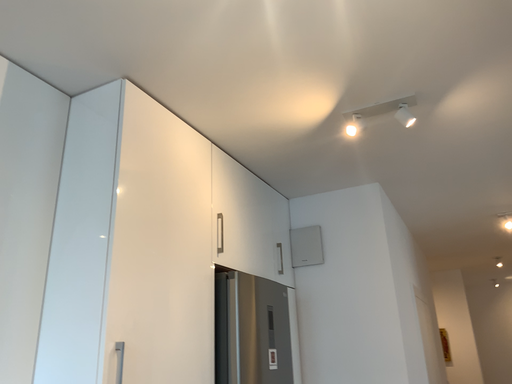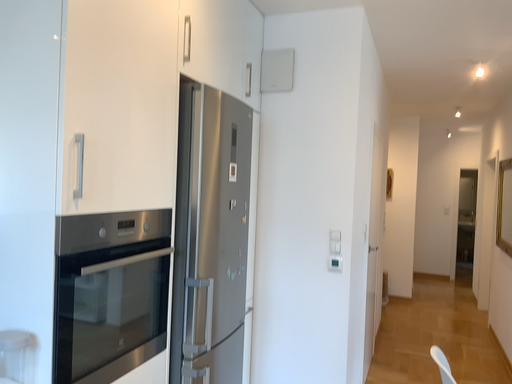
Question: How did the camera likely rotate when shooting the video?

Choices:
 (A) rotated upward
 (B) rotated downward

Answer: (B)